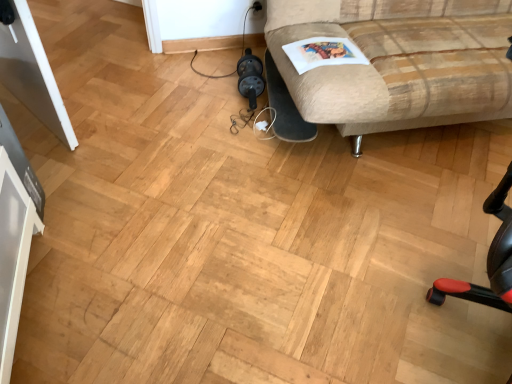
Locate an element on the screen. This screenshot has width=512, height=384. white paper magazine at upper right is located at coordinates (323, 53).

The image size is (512, 384). What do you see at coordinates (323, 53) in the screenshot?
I see `white paper magazine at upper right` at bounding box center [323, 53].

In order to face white paper magazine at upper right, should I rotate leftwards or rightwards?

A 9.078 degree turn to the right will do.

Where is `beige fabric couch at upper right`? The height and width of the screenshot is (384, 512). beige fabric couch at upper right is located at coordinates (398, 62).

Describe the element at coordinates (398, 62) in the screenshot. I see `beige fabric couch at upper right` at that location.

Locate an element on the screen. Image resolution: width=512 pixels, height=384 pixels. white paper magazine at upper right is located at coordinates (323, 53).

Visually, is white paper magazine at upper right positioned to the left or to the right of beige fabric couch at upper right?

From the image, it's evident that white paper magazine at upper right is to the left of beige fabric couch at upper right.

Is white paper magazine at upper right behind beige fabric couch at upper right?

Yes.

Does point (310, 51) come in front of point (366, 91)?

No.

From the image's perspective, is white paper magazine at upper right under beige fabric couch at upper right?

Yes.

From a real-world perspective, is white paper magazine at upper right under beige fabric couch at upper right?

Yes.

Which object is wider, white paper magazine at upper right or beige fabric couch at upper right?

With larger width is beige fabric couch at upper right.

Can you confirm if white paper magazine at upper right is shorter than beige fabric couch at upper right?

Yes, white paper magazine at upper right is shorter than beige fabric couch at upper right.

Which of these two, white paper magazine at upper right or beige fabric couch at upper right, is smaller?

white paper magazine at upper right.

Is white paper magazine at upper right positioned beyond the bounds of beige fabric couch at upper right?

Actually, white paper magazine at upper right is within beige fabric couch at upper right.

Does white paper magazine at upper right touch beige fabric couch at upper right?

No, white paper magazine at upper right is not making contact with beige fabric couch at upper right.

In the scene shown: Could you tell me if white paper magazine at upper right is turned towards beige fabric couch at upper right?

Yes, white paper magazine at upper right is facing beige fabric couch at upper right.

From the picture: How many degrees apart are the facing directions of white paper magazine at upper right and beige fabric couch at upper right?

white paper magazine at upper right and beige fabric couch at upper right are facing 4.23 degrees away from each other.

How far apart are white paper magazine at upper right and beige fabric couch at upper right?

11.89 inches.

The image size is (512, 384). In order to click on magazine that appears behind the beige fabric couch at upper right in this screenshot , I will do `click(323, 53)`.

Considering the relative positions of beige fabric couch at upper right and white paper magazine at upper right in the image provided, is beige fabric couch at upper right to the left of white paper magazine at upper right from the viewer's perspective?

Incorrect, beige fabric couch at upper right is not on the left side of white paper magazine at upper right.

Which object is closer to the camera, beige fabric couch at upper right or white paper magazine at upper right?

beige fabric couch at upper right is in front.

Which is in front, point (368, 124) or point (332, 38)?

The point (368, 124) is in front.

From the image's perspective, relative to white paper magazine at upper right, is beige fabric couch at upper right above or below?

Based on their image positions, beige fabric couch at upper right is located above white paper magazine at upper right.

From a real-world perspective, which is physically above, beige fabric couch at upper right or white paper magazine at upper right?

beige fabric couch at upper right.

Considering the sizes of objects beige fabric couch at upper right and white paper magazine at upper right in the image provided, who is thinner, beige fabric couch at upper right or white paper magazine at upper right?

white paper magazine at upper right.

From their relative heights in the image, would you say beige fabric couch at upper right is taller or shorter than white paper magazine at upper right?

beige fabric couch at upper right is taller than white paper magazine at upper right.

Which of these two, beige fabric couch at upper right or white paper magazine at upper right, is smaller?

white paper magazine at upper right.

Would you say beige fabric couch at upper right is outside white paper magazine at upper right?

beige fabric couch at upper right is positioned outside white paper magazine at upper right.

Is beige fabric couch at upper right next to white paper magazine at upper right and touching it?

No, beige fabric couch at upper right is not beside white paper magazine at upper right.

Does beige fabric couch at upper right turn towards white paper magazine at upper right?

Yes, beige fabric couch at upper right is aimed at white paper magazine at upper right.

How different are the orientations of beige fabric couch at upper right and white paper magazine at upper right in degrees?

4.23 degrees separate the facing orientations of beige fabric couch at upper right and white paper magazine at upper right.

The width and height of the screenshot is (512, 384). I want to click on studio couch above the white paper magazine at upper right (from a real-world perspective), so click(398, 62).

I want to click on studio couch that appears on the right of white paper magazine at upper right, so click(398, 62).

This screenshot has height=384, width=512. I want to click on magazine located on the left of beige fabric couch at upper right, so click(323, 53).